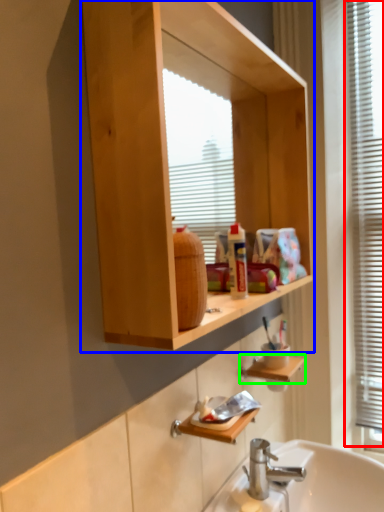
Question: Based on their relative distances, which object is farther from window frame (highlighted by a red box)? Choose from bathroom cabinet (highlighted by a blue box) and cabinet (highlighted by a green box).

Choices:
 (A) bathroom cabinet
 (B) cabinet

Answer: (B)